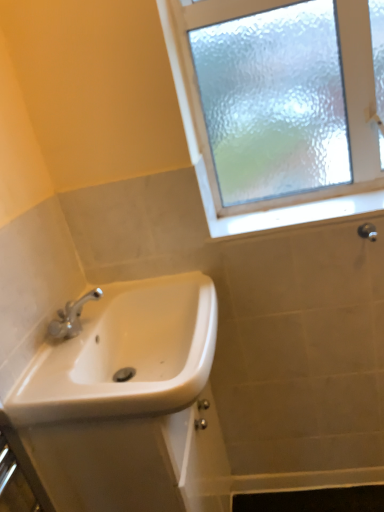
The width and height of the screenshot is (384, 512). Identify the location of vacant region above white glossy window sill at upper right (from a real-world perspective). (304, 209).